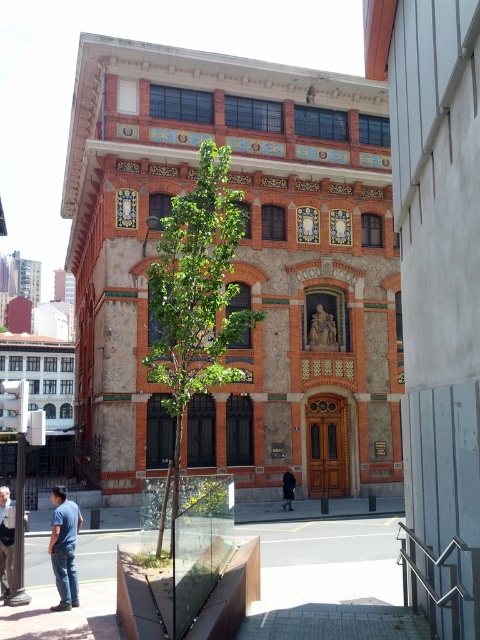
Can you confirm if smooth concrete pavement at lower center is smaller than denim jacket at lower left?

Actually, smooth concrete pavement at lower center might be larger than denim jacket at lower left.

Can you confirm if smooth concrete pavement at lower center is bigger than denim jacket at lower left?

Indeed, smooth concrete pavement at lower center has a larger size compared to denim jacket at lower left.

The image size is (480, 640). In order to click on smooth concrete pavement at lower center in this screenshot , I will do pyautogui.click(x=330, y=582).

From the picture: Is blue denim jeans at lower left taller than dark gray coat at center?

Correct, blue denim jeans at lower left is much taller as dark gray coat at center.

Does blue denim jeans at lower left have a lesser height compared to dark gray coat at center?

No, blue denim jeans at lower left is not shorter than dark gray coat at center.

This screenshot has width=480, height=640. In order to click on blue denim jeans at lower left in this screenshot , I will do `click(63, 547)`.

Can you confirm if green leafy tree at center is positioned to the left of dark gray coat at center?

Indeed, green leafy tree at center is positioned on the left side of dark gray coat at center.

Can you confirm if green leafy tree at center is bigger than dark gray coat at center?

Indeed, green leafy tree at center has a larger size compared to dark gray coat at center.

This screenshot has width=480, height=640. Identify the location of green leafy tree at center. (195, 296).